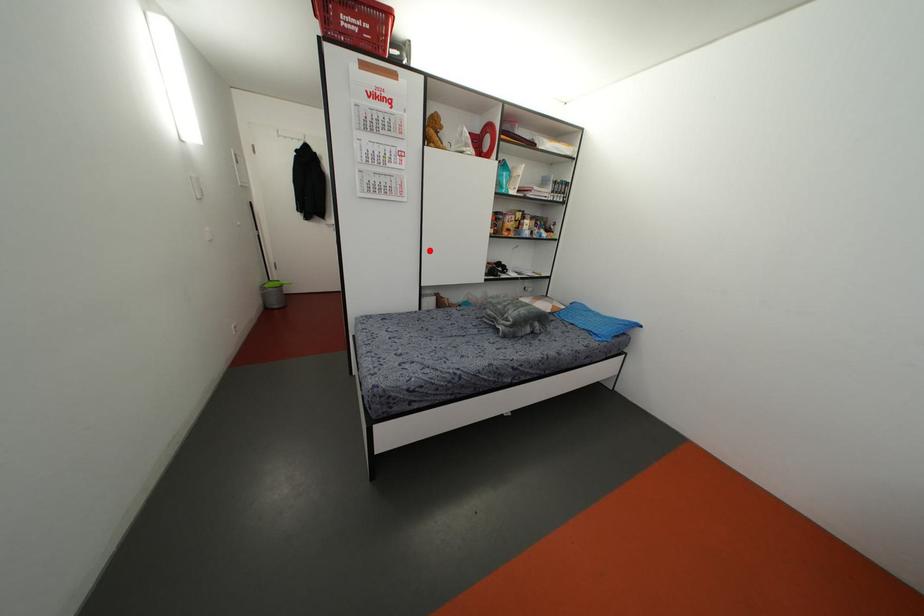
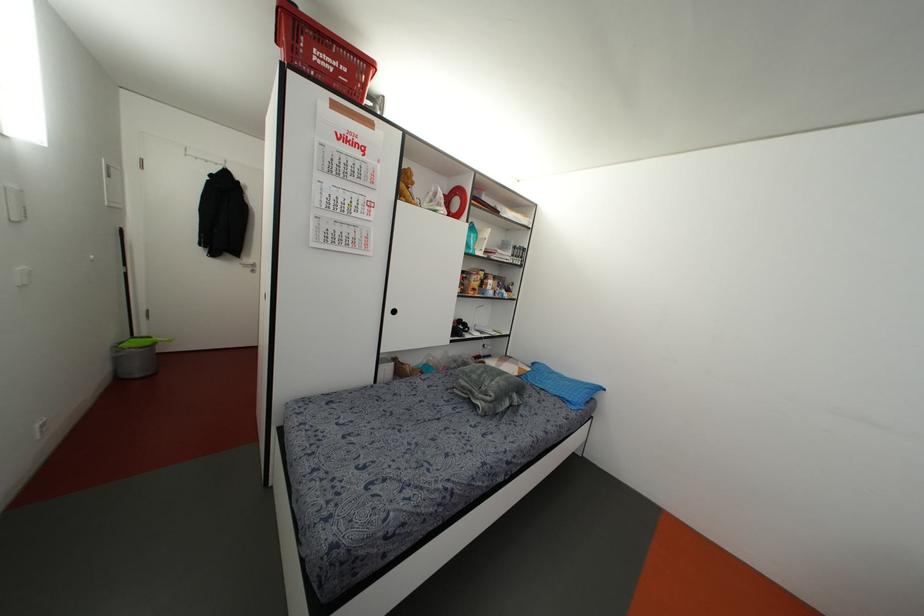
Find the pixel in the second image that matches the highlighted location in the first image.

(394, 310)